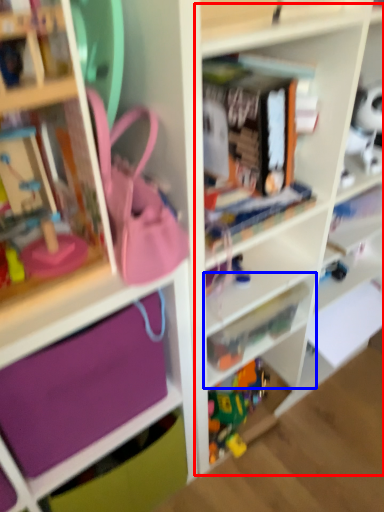
Question: Which object is closer to the camera taking this photo, cabinet (highlighted by a red box) or shelf (highlighted by a blue box)?

Choices:
 (A) cabinet
 (B) shelf

Answer: (A)